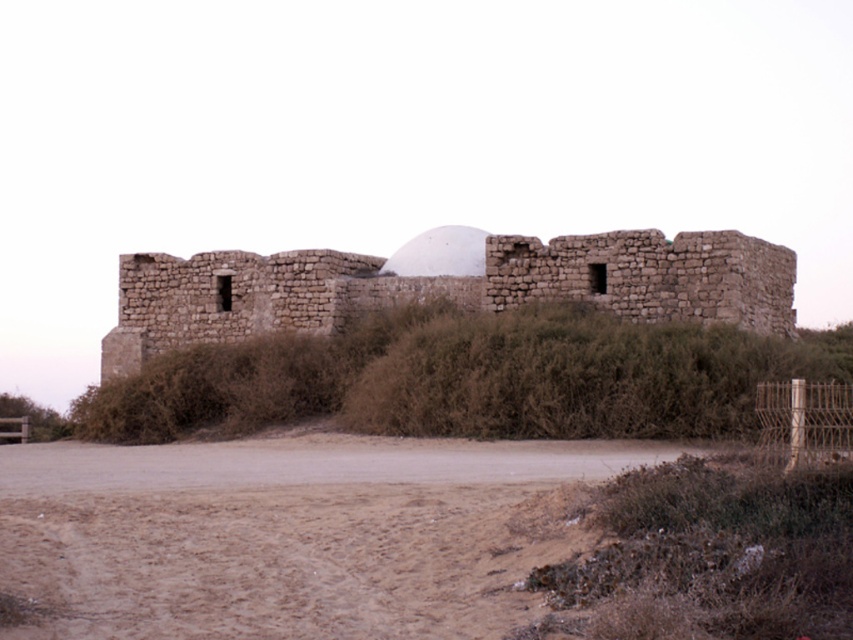
You are an archaeologist examining the ancient stone structure. You notice the brown sandy dirt field at lower left and the brown stone ruins at center. Which area has a larger land area coverage?

The brown stone ruins at center has a larger land area coverage than the brown sandy dirt field at lower left according to the description.

You are an archaeologist standing on the brown sandy dirt field at lower left and want to reach the entrance of the brown stone ruins at center. Which direction should you move to get closer to the ruins?

You should move towards the center from the lower left to reach the entrance of the brown stone ruins at center, as the brown sandy dirt field at lower left is located at the lower left side and the ruins are at the center.

You are standing at the entrance of the ancient stone structure and want to walk to the brown sandy dirt field at lower left. Which direction should you head towards?

The brown sandy dirt field at lower left is located at point (294,532), so you should head towards the lower left direction from your current position at the entrance.